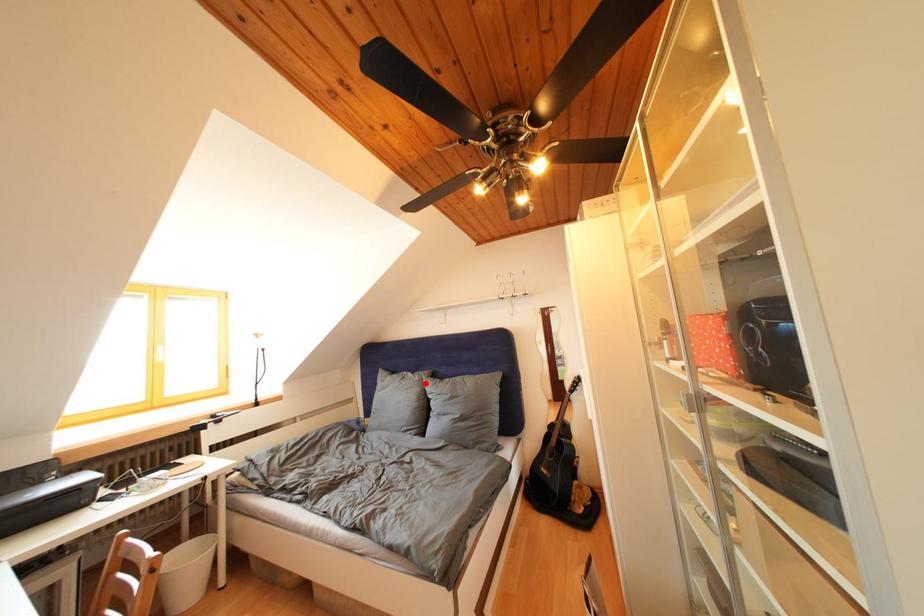
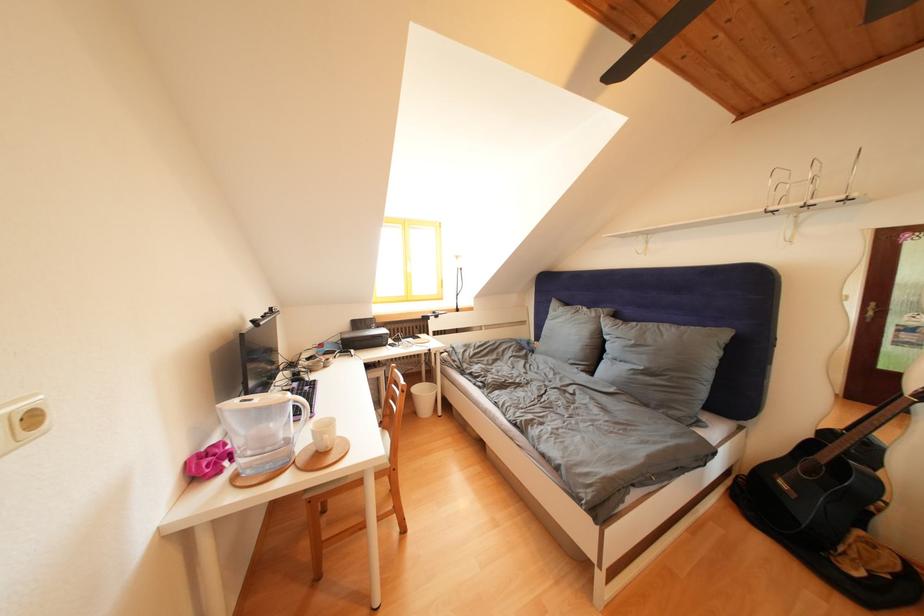
Locate, in the second image, the point that corresponds to the highlighted location in the first image.

(602, 320)